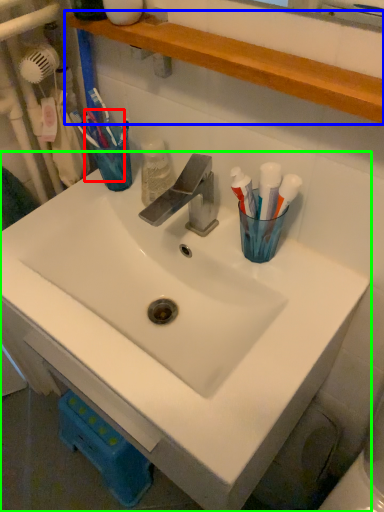
Question: Which object is positioned farthest from toothbrush (highlighted by a red box)? Select from shelve (highlighted by a blue box) and sink (highlighted by a green box).

Choices:
 (A) shelve
 (B) sink

Answer: (B)